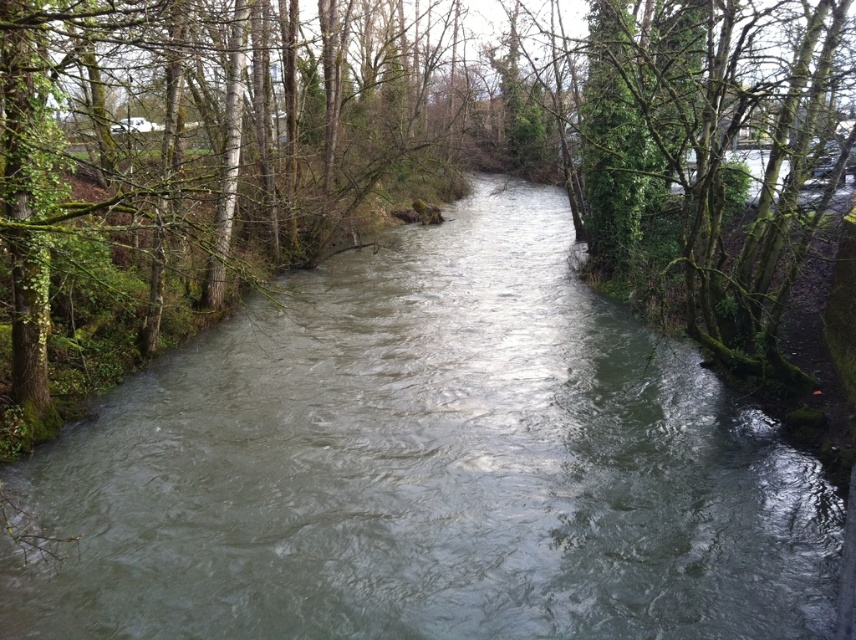
You are standing at the point labeled point (783,577). You want to cross the river to reach the opposite bank. The river is 8.03 meters wide at this point. If your inflatable boat can carry a maximum weight of 100 kg and you weigh 70 kg, how many 10 kg items can you safely transport in one trip without exceeding the boat capacity?

The boat can carry a maximum of 100 kg. Subtracting your weight of 70 kg, you have 30 kg remaining. Each item is 10 kg, so you can safely transport 3 items in one trip.